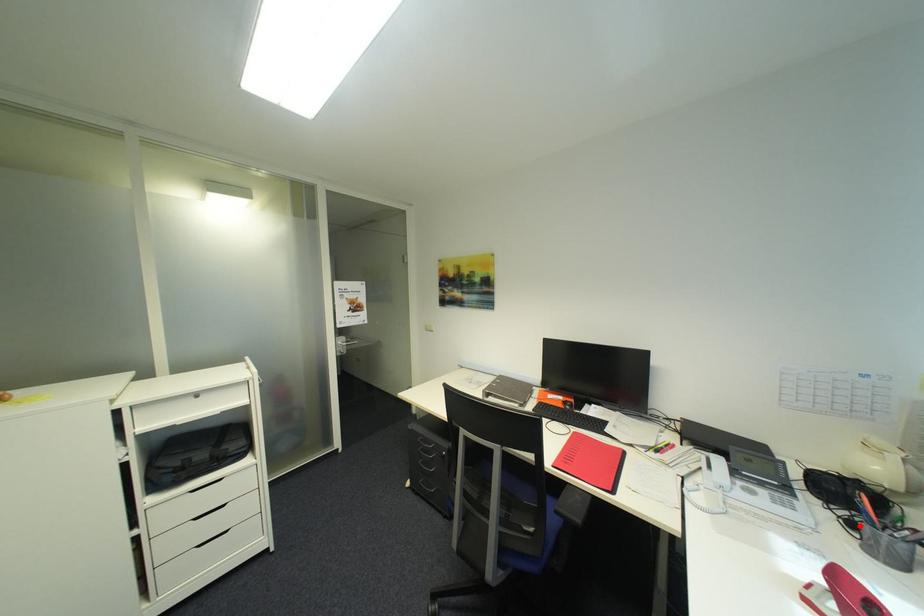
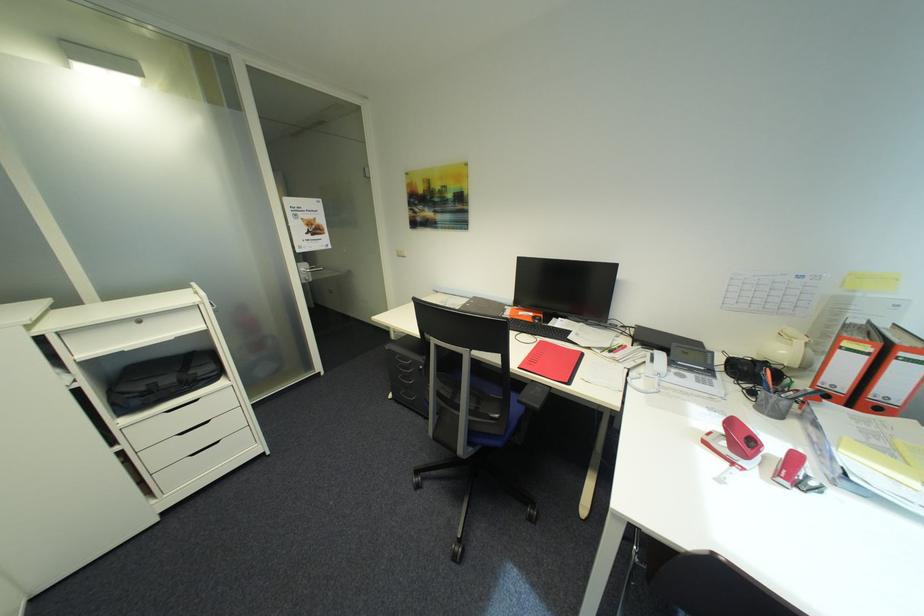
In the second image, find the point that corresponds to the highlighted location in the first image.

(760, 392)